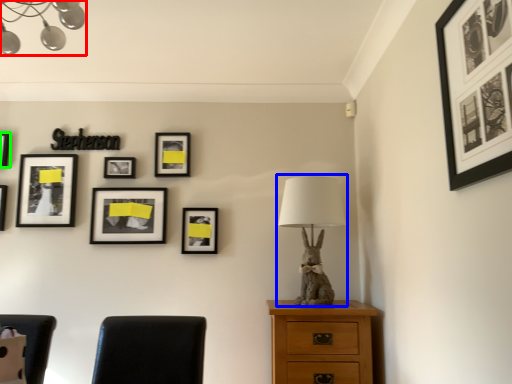
Question: Which object is the farthest from lamp (highlighted by a red box)? Choose among these: table lamp (highlighted by a blue box) or picture frame (highlighted by a green box).

Choices:
 (A) table lamp
 (B) picture frame

Answer: (A)